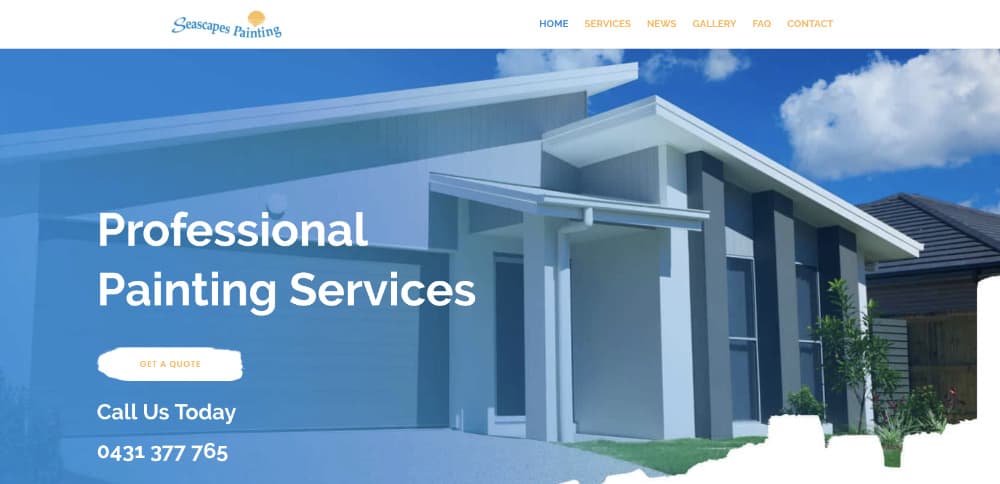
Find the location of a particular element. Image resolution: width=1000 pixels, height=484 pixels. pillar is located at coordinates (529, 388).